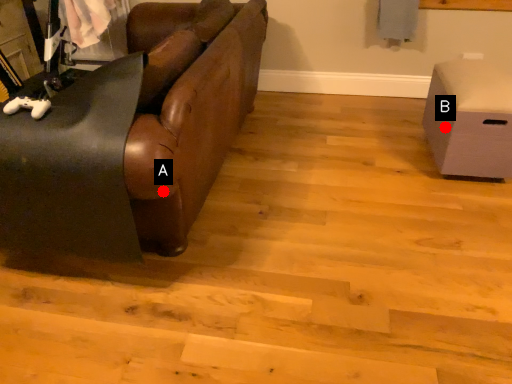
Question: Two points are circled on the image, labeled by A and B beside each circle. Which point is closer to the camera?

Choices:
 (A) A is closer
 (B) B is closer

Answer: (A)